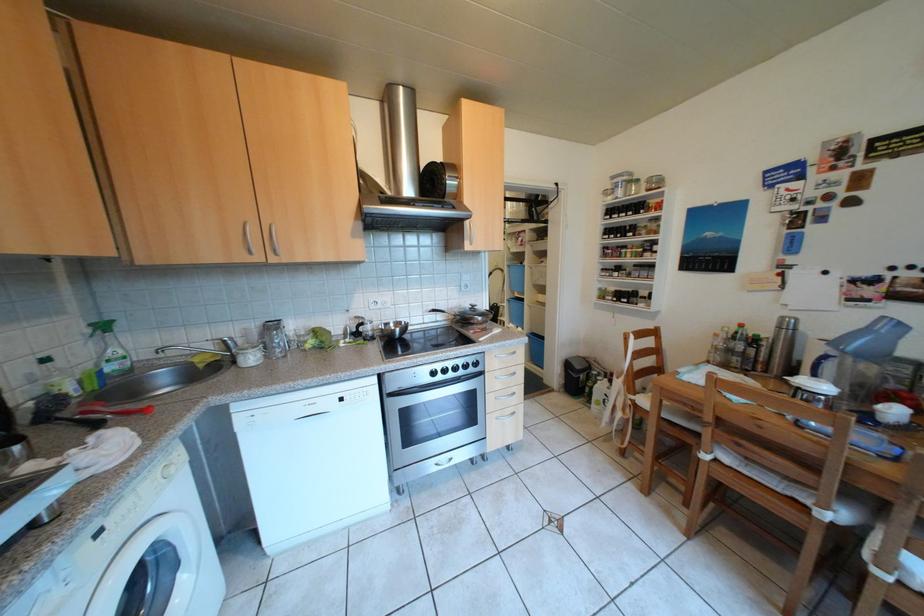
Find the location of a particular element. white jar lid is located at coordinates (812, 385).